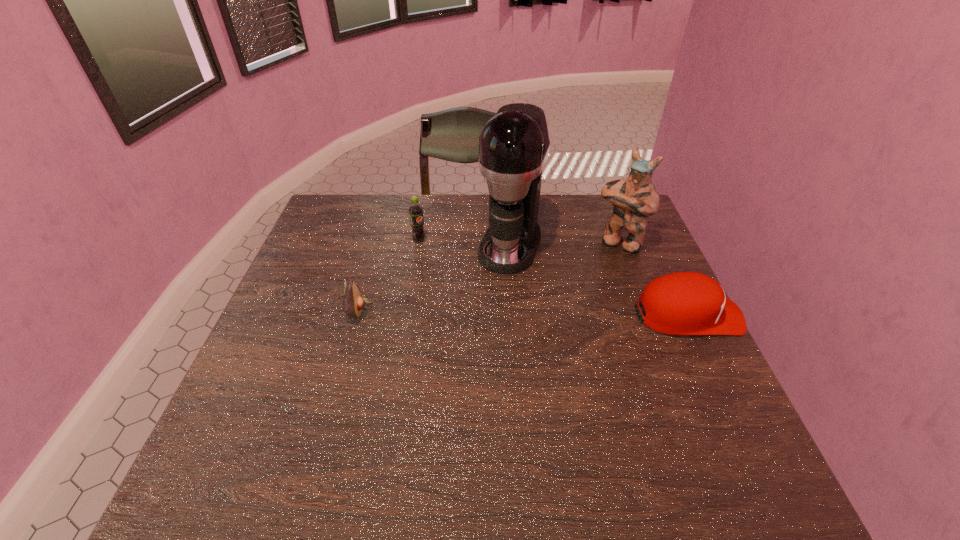
The height and width of the screenshot is (540, 960). I want to click on vacant area that lies between the avocado and the figurine, so click(x=489, y=276).

Find the location of a particular element. The height and width of the screenshot is (540, 960). vacant region between the fourth shortest object and the baseball cap is located at coordinates (654, 279).

Where is `vacant space that's between the coffee maker and the leftmost object`? This screenshot has width=960, height=540. vacant space that's between the coffee maker and the leftmost object is located at coordinates (435, 278).

This screenshot has width=960, height=540. What are the coordinates of `empty space that is in between the tallest object and the baseball cap` in the screenshot? It's located at (599, 280).

Image resolution: width=960 pixels, height=540 pixels. What are the coordinates of `free area in between the soda and the avocado` in the screenshot? It's located at (389, 275).

Locate an element on the screen. object that is the third closest to the fourth shortest object is located at coordinates (415, 210).

At what (x,y) coordinates should I click in order to perform the action: click on object that stands as the fourth closest to the baseball cap. Please return your answer as a coordinate pair (x, y). The width and height of the screenshot is (960, 540). Looking at the image, I should click on 353,301.

Where is `blank area in the image that satisfies the following two spatial constraints: 1. on the back side of the coffee maker; 2. on the left side of the figurine`? The height and width of the screenshot is (540, 960). blank area in the image that satisfies the following two spatial constraints: 1. on the back side of the coffee maker; 2. on the left side of the figurine is located at coordinates (510, 242).

The height and width of the screenshot is (540, 960). I want to click on blank space that satisfies the following two spatial constraints: 1. on the front side of the tallest object; 2. on the front-facing side of the baseball cap, so click(516, 315).